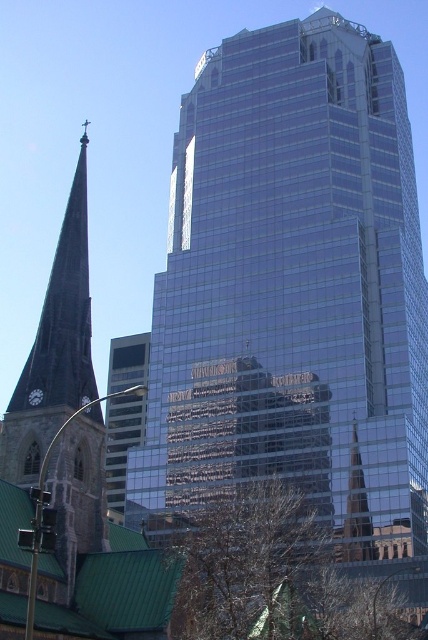
Does transparent glass skyscraper at center have a smaller size compared to clear glass skyscraper at center?

Incorrect, transparent glass skyscraper at center is not smaller in size than clear glass skyscraper at center.

At what (x,y) coordinates should I click in order to perform the action: click on transparent glass skyscraper at center. Please return your answer as a coordinate pair (x, y). This screenshot has height=640, width=428. Looking at the image, I should click on point(293,291).

The height and width of the screenshot is (640, 428). What do you see at coordinates (293, 291) in the screenshot? I see `transparent glass skyscraper at center` at bounding box center [293, 291].

Where is `transparent glass skyscraper at center`? This screenshot has height=640, width=428. transparent glass skyscraper at center is located at coordinates (293, 291).

Is transparent glass skyscraper at center above shiny glass spire at center?

Yes.

Does transparent glass skyscraper at center have a greater width compared to shiny glass spire at center?

Indeed, transparent glass skyscraper at center has a greater width compared to shiny glass spire at center.

The width and height of the screenshot is (428, 640). In order to click on transparent glass skyscraper at center in this screenshot , I will do `click(293, 291)`.

Who is more forward, [107,468] or [341,536]?

Point [341,536] is in front.

Between clear glass skyscraper at center and shiny glass spire at center, which one is positioned higher?

shiny glass spire at center

The width and height of the screenshot is (428, 640). What are the coordinates of `clear glass skyscraper at center` in the screenshot? It's located at (121, 448).